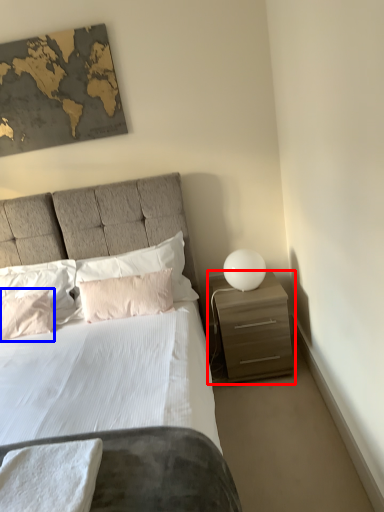
Question: Which point is further to the camera, nightstand (highlighted by a red box) or pillow (highlighted by a blue box)?

Choices:
 (A) nightstand
 (B) pillow

Answer: (B)